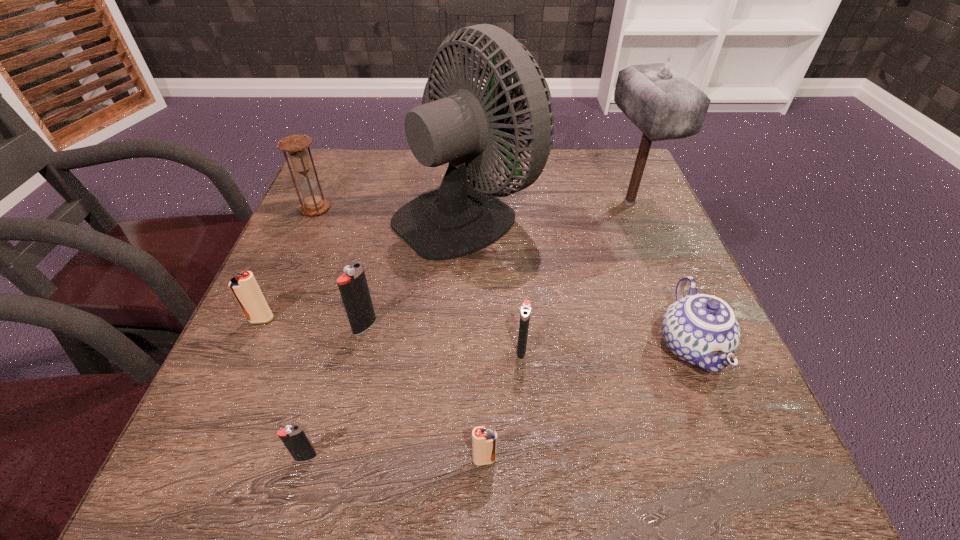
The height and width of the screenshot is (540, 960). I want to click on fan, so click(461, 217).

At what (x,y) coordinates should I click in order to perform the action: click on mallet. Please return your answer as a coordinate pair (x, y). Image resolution: width=960 pixels, height=540 pixels. Looking at the image, I should click on (664, 105).

Identify the location of the seventh shortest object. (296, 145).

This screenshot has height=540, width=960. I want to click on brown hourglass, so click(296, 145).

Where is `the tallest igniter`? the tallest igniter is located at coordinates (353, 287).

What are the coordinates of `the farthest black igniter` in the screenshot? It's located at (353, 287).

Where is `the second smallest black igniter`? This screenshot has width=960, height=540. the second smallest black igniter is located at coordinates (526, 306).

This screenshot has height=540, width=960. What are the coordinates of `the third nearest igniter` in the screenshot? It's located at (526, 306).

Image resolution: width=960 pixels, height=540 pixels. Find the location of `the left red igniter`. the left red igniter is located at coordinates (244, 286).

The image size is (960, 540). I want to click on the leftmost igniter, so click(244, 286).